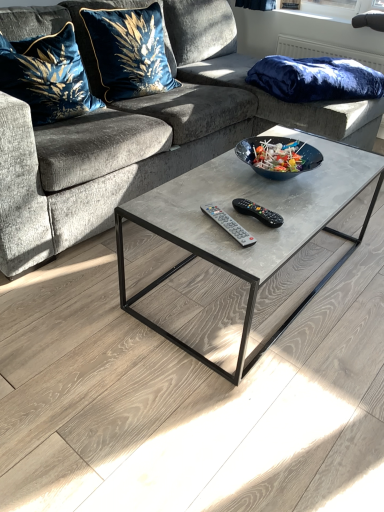
Question: Does velvet fabric couch at center lie in front of velvet blue pillow at upper left, which appears as the second pillow when viewed from the left?

Choices:
 (A) yes
 (B) no

Answer: (A)

Question: Is velvet fabric couch at center not near velvet blue pillow at upper left, which appears as the second pillow when viewed from the left?

Choices:
 (A) yes
 (B) no

Answer: (B)

Question: From the image's perspective, is velvet fabric couch at center under velvet blue pillow at upper left, which appears as the second pillow when viewed from the left?

Choices:
 (A) no
 (B) yes

Answer: (B)

Question: Is velvet fabric couch at center located outside velvet blue pillow at upper left, which appears as the second pillow when viewed from the right?

Choices:
 (A) yes
 (B) no

Answer: (A)

Question: Considering the relative sizes of velvet fabric couch at center and velvet blue pillow at upper left, which appears as the second pillow when viewed from the left, in the image provided, is velvet fabric couch at center shorter than velvet blue pillow at upper left, which appears as the second pillow when viewed from the left,?

Choices:
 (A) yes
 (B) no

Answer: (B)

Question: Considering the relative sizes of velvet fabric couch at center and velvet blue pillow at upper left, which appears as the second pillow when viewed from the right, in the image provided, is velvet fabric couch at center taller than velvet blue pillow at upper left, which appears as the second pillow when viewed from the right,?

Choices:
 (A) no
 (B) yes

Answer: (B)

Question: From the image's perspective, is black plastic remote at center, marked as the 1th remote in a right-to-left arrangement, beneath velvet blue pillow at upper left, marked as the first pillow in a left-to-right arrangement?

Choices:
 (A) no
 (B) yes

Answer: (B)

Question: Could velvet blue pillow at upper left, which appears as the third pillow when viewed from the right, be considered to be inside black plastic remote at center, marked as the 1th remote in a right-to-left arrangement?

Choices:
 (A) no
 (B) yes

Answer: (A)

Question: Is black plastic remote at center, the 2th remote in the left-to-right sequence, smaller than velvet blue pillow at upper left, which appears as the third pillow when viewed from the right?

Choices:
 (A) no
 (B) yes

Answer: (B)

Question: Does black plastic remote at center, the 2th remote in the left-to-right sequence, turn towards velvet blue pillow at upper left, which appears as the third pillow when viewed from the right?

Choices:
 (A) yes
 (B) no

Answer: (B)

Question: Considering the relative sizes of black plastic remote at center, the 2th remote in the left-to-right sequence, and velvet blue pillow at upper left, marked as the first pillow in a left-to-right arrangement, in the image provided, is black plastic remote at center, the 2th remote in the left-to-right sequence, taller than velvet blue pillow at upper left, marked as the first pillow in a left-to-right arrangement,?

Choices:
 (A) yes
 (B) no

Answer: (B)

Question: Considering the relative sizes of black plastic remote at center, marked as the 1th remote in a right-to-left arrangement, and velvet blue pillow at upper left, marked as the first pillow in a left-to-right arrangement, in the image provided, is black plastic remote at center, marked as the 1th remote in a right-to-left arrangement, shorter than velvet blue pillow at upper left, marked as the first pillow in a left-to-right arrangement,?

Choices:
 (A) yes
 (B) no

Answer: (A)

Question: Considering the relative sizes of velvet blue pillow at upper left, marked as the first pillow in a left-to-right arrangement, and velvety blue pillow at upper right, arranged as the 1th pillow when viewed from the right, in the image provided, is velvet blue pillow at upper left, marked as the first pillow in a left-to-right arrangement, shorter than velvety blue pillow at upper right, arranged as the 1th pillow when viewed from the right,?

Choices:
 (A) no
 (B) yes

Answer: (A)